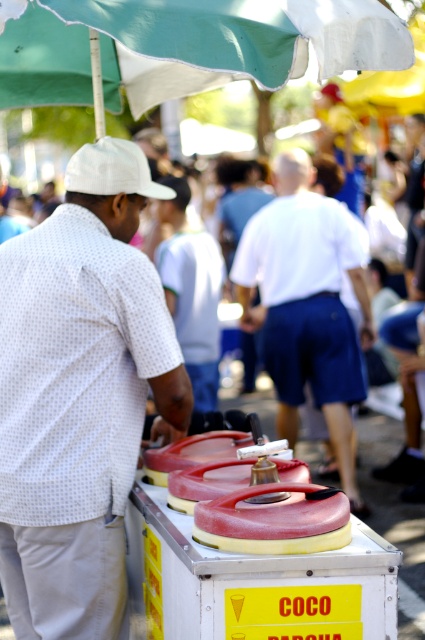
Does white cotton shirt at center come behind white matte baseball cap at left?

That is True.

Is white cotton shirt at center taller than white matte baseball cap at left?

Yes, white cotton shirt at center is taller than white matte baseball cap at left.

Locate an element on the screen. The image size is (425, 640). white cotton shirt at center is located at coordinates (306, 305).

Can you confirm if white dotted shirt at left is positioned to the right of white matte baseball cap at left?

Incorrect, white dotted shirt at left is not on the right side of white matte baseball cap at left.

Can you confirm if white dotted shirt at left is positioned above white matte baseball cap at left?

No.

Does point (136, 385) come behind point (116, 186)?

No.

Image resolution: width=425 pixels, height=640 pixels. Find the location of `white dotted shirt at left`. white dotted shirt at left is located at coordinates (79, 394).

Is green fabric umbrella at upper center below white matte baseball cap at left?

No.

Who is more distant from viewer, (48, 88) or (101, 189)?

Positioned behind is point (48, 88).

This screenshot has height=640, width=425. What do you see at coordinates (186, 45) in the screenshot?
I see `green fabric umbrella at upper center` at bounding box center [186, 45].

Image resolution: width=425 pixels, height=640 pixels. What are the coordinates of `green fabric umbrella at upper center` in the screenshot? It's located at (186, 45).